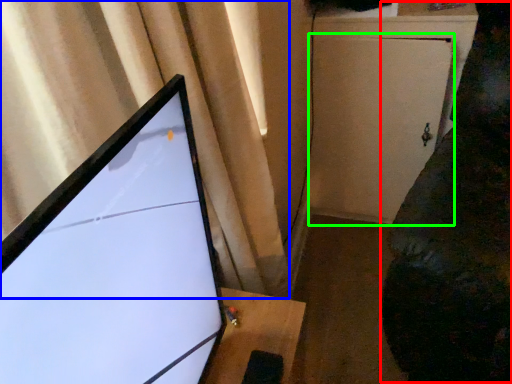
Question: Based on their relative distances, which object is farther from couch (highlighted by a red box)? Choose from curtain (highlighted by a blue box) and screen door (highlighted by a green box).

Choices:
 (A) curtain
 (B) screen door

Answer: (A)